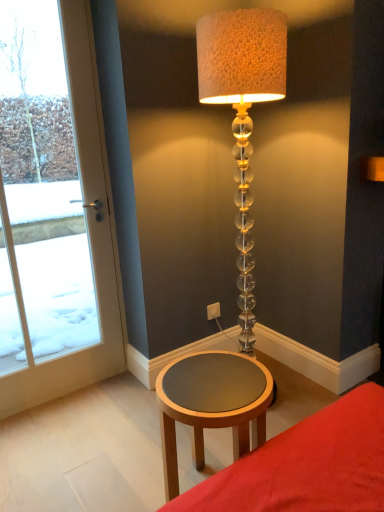
Question: From a real-world perspective, is white glass door at left over white plastic electric outlet at lower center?

Choices:
 (A) no
 (B) yes

Answer: (B)

Question: Does white glass door at left touch white plastic electric outlet at lower center?

Choices:
 (A) no
 (B) yes

Answer: (A)

Question: Does white glass door at left lie behind white plastic electric outlet at lower center?

Choices:
 (A) yes
 (B) no

Answer: (B)

Question: From a real-world perspective, is white glass door at left below white plastic electric outlet at lower center?

Choices:
 (A) no
 (B) yes

Answer: (A)

Question: Considering the relative positions of white glass door at left and white plastic electric outlet at lower center in the image provided, is white glass door at left in front of white plastic electric outlet at lower center?

Choices:
 (A) yes
 (B) no

Answer: (A)

Question: Considering the positions of wooden round table at lower center and white plastic electric outlet at lower center in the image, is wooden round table at lower center wider or thinner than white plastic electric outlet at lower center?

Choices:
 (A) thin
 (B) wide

Answer: (B)

Question: In the image, is wooden round table at lower center positioned in front of or behind white plastic electric outlet at lower center?

Choices:
 (A) front
 (B) behind

Answer: (A)

Question: Based on their positions, is wooden round table at lower center located to the left or right of white plastic electric outlet at lower center?

Choices:
 (A) right
 (B) left

Answer: (B)

Question: From a real-world perspective, relative to white plastic electric outlet at lower center, is wooden round table at lower center vertically above or below?

Choices:
 (A) below
 (B) above

Answer: (A)

Question: In terms of height, does matte brown table at lower center look taller or shorter compared to wooden round table at lower center?

Choices:
 (A) short
 (B) tall

Answer: (A)

Question: From a real-world perspective, is matte brown table at lower center physically located above or below wooden round table at lower center?

Choices:
 (A) below
 (B) above

Answer: (B)

Question: In terms of width, does matte brown table at lower center look wider or thinner when compared to wooden round table at lower center?

Choices:
 (A) wide
 (B) thin

Answer: (A)

Question: Considering their positions, is matte brown table at lower center located in front of or behind wooden round table at lower center?

Choices:
 (A) front
 (B) behind

Answer: (A)

Question: From the image's perspective, relative to translucent glass lamp at center, is matte brown table at lower center above or below?

Choices:
 (A) below
 (B) above

Answer: (A)

Question: Is matte brown table at lower center in front of or behind translucent glass lamp at center in the image?

Choices:
 (A) behind
 (B) front

Answer: (B)